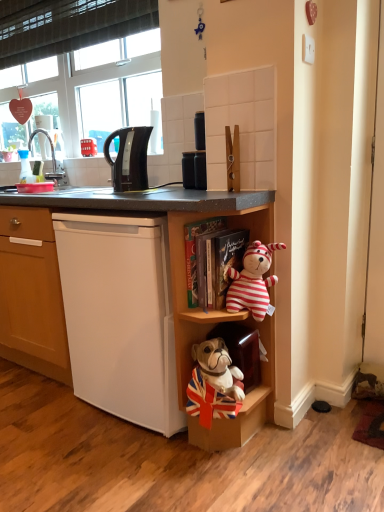
Question: Does white matte cabinet at lower right, the 2th cabinet in the right-to-left sequence, have a smaller size compared to striped plush toy at upper right?

Choices:
 (A) yes
 (B) no

Answer: (B)

Question: From a real-world perspective, is white matte cabinet at lower right, the 2th cabinet in the right-to-left sequence, positioned over striped plush toy at upper right based on gravity?

Choices:
 (A) no
 (B) yes

Answer: (A)

Question: Considering the relative sizes of white matte cabinet at lower right, the 2th cabinet in the right-to-left sequence, and striped plush toy at upper right in the image provided, is white matte cabinet at lower right, the 2th cabinet in the right-to-left sequence, thinner than striped plush toy at upper right?

Choices:
 (A) yes
 (B) no

Answer: (B)

Question: From the image's perspective, is white matte cabinet at lower right, the 2th cabinet in the right-to-left sequence, above striped plush toy at upper right?

Choices:
 (A) no
 (B) yes

Answer: (A)

Question: Can you confirm if white matte cabinet at lower right, which appears as the first cabinet when viewed from the left, is wider than striped plush toy at upper right?

Choices:
 (A) yes
 (B) no

Answer: (A)

Question: From the image's perspective, is white matte cabinet at lower right, the 2th cabinet in the right-to-left sequence, under striped plush toy at upper right?

Choices:
 (A) no
 (B) yes

Answer: (B)

Question: Is white matte refrigerator at lower left thinner than transparent plastic bottle at left?

Choices:
 (A) yes
 (B) no

Answer: (B)

Question: Does white matte refrigerator at lower left have a larger size compared to transparent plastic bottle at left?

Choices:
 (A) no
 (B) yes

Answer: (B)

Question: From a real-world perspective, is white matte refrigerator at lower left positioned under transparent plastic bottle at left based on gravity?

Choices:
 (A) no
 (B) yes

Answer: (B)

Question: Is white matte refrigerator at lower left closer to camera compared to transparent plastic bottle at left?

Choices:
 (A) no
 (B) yes

Answer: (B)

Question: Is white matte refrigerator at lower left at the right side of transparent plastic bottle at left?

Choices:
 (A) no
 (B) yes

Answer: (B)

Question: Is transparent plastic bottle at left completely or partially inside white matte refrigerator at lower left?

Choices:
 (A) no
 (B) yes

Answer: (A)

Question: From a real-world perspective, is brushed metal faucet at upper left physically above velvet-like brown cabinet at lower center, which ranks as the 1th cabinet in right-to-left order?

Choices:
 (A) yes
 (B) no

Answer: (A)